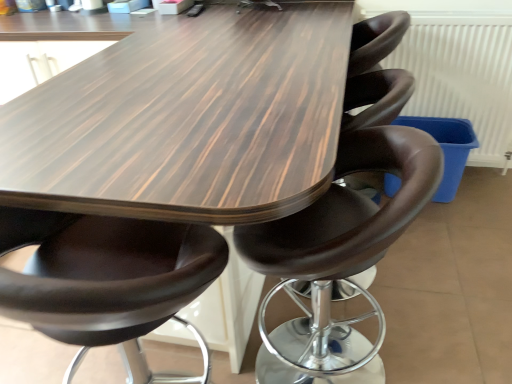
The width and height of the screenshot is (512, 384). Identify the location of vacant space situated above wooden table at center (from a real-world perspective). (185, 82).